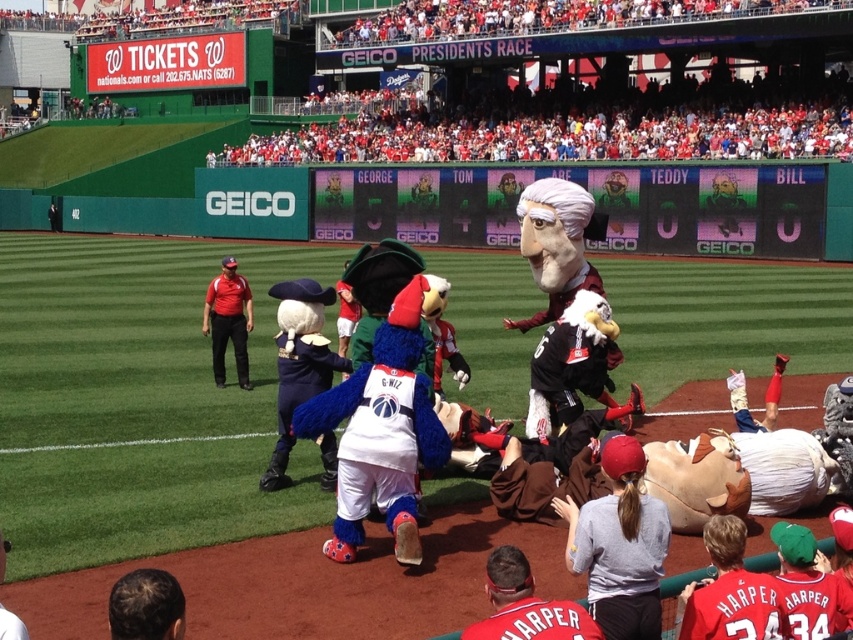
Does red fabric cap at lower center appear over red shirt at center?

Incorrect, red fabric cap at lower center is not positioned above red shirt at center.

Who is lower down, red fabric cap at lower center or red shirt at center?

red fabric cap at lower center is below.

This screenshot has width=853, height=640. Find the location of `red fabric cap at lower center`. red fabric cap at lower center is located at coordinates (525, 605).

Which is more to the left, gray cotton shirt at lower center or dark brown hair at lower left?

From the viewer's perspective, dark brown hair at lower left appears more on the left side.

Describe the element at coordinates (619, 545) in the screenshot. I see `gray cotton shirt at lower center` at that location.

Between point (624, 536) and point (154, 592), which one is positioned in front?

Point (154, 592)

Find the location of a particular element. gray cotton shirt at lower center is located at coordinates (619, 545).

Is point (368, 461) in front of point (236, 307)?

Yes.

Based on the photo, is blue plush mascot at center thinner than red shirt at center?

Yes.

Who is more distant from viewer, (358, 445) or (216, 378)?

The point (216, 378) is behind.

I want to click on blue plush mascot at center, so click(381, 433).